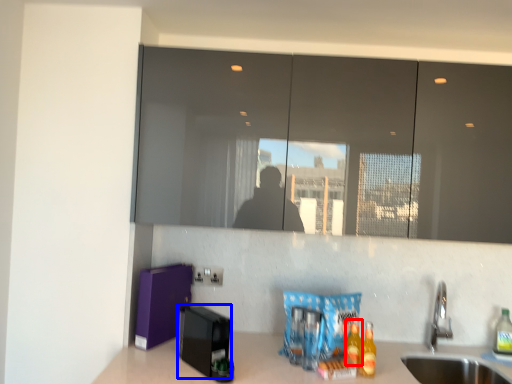
Question: Which of the following is the farthest to the observer, beverage (highlighted by a red box) or appliance (highlighted by a blue box)?

Choices:
 (A) beverage
 (B) appliance

Answer: (A)